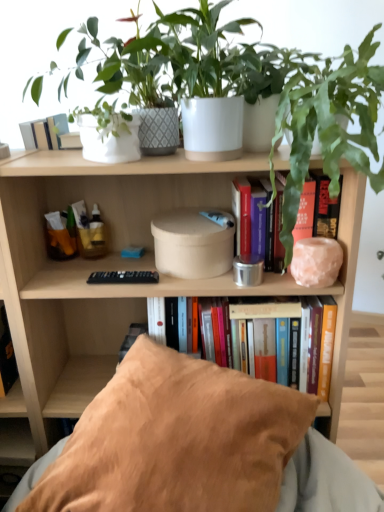
Question: Does beige fabric pillow at lower center have a smaller size compared to hardcover book at center, placed as the 2th book when sorted from bottom to top?

Choices:
 (A) no
 (B) yes

Answer: (A)

Question: Would you say beige fabric pillow at lower center is a long distance from hardcover book at center, placed as the 2th book when sorted from bottom to top?

Choices:
 (A) yes
 (B) no

Answer: (B)

Question: Is beige fabric pillow at lower center shorter than hardcover book at center, the 1th book viewed from the top?

Choices:
 (A) no
 (B) yes

Answer: (A)

Question: Is beige fabric pillow at lower center to the right of hardcover book at center, placed as the 2th book when sorted from bottom to top, from the viewer's perspective?

Choices:
 (A) yes
 (B) no

Answer: (B)

Question: Does beige fabric pillow at lower center have a greater width compared to hardcover book at center, placed as the 2th book when sorted from bottom to top?

Choices:
 (A) no
 (B) yes

Answer: (B)

Question: From a real-world perspective, is beige fabric pillow at lower center located higher than hardcover book at center, placed as the 2th book when sorted from bottom to top?

Choices:
 (A) yes
 (B) no

Answer: (B)

Question: Can you confirm if green leafy plant at upper right, the 1th houseplant when ordered from right to left, is taller than white ceramic pot at upper center, which appears as the 2th houseplant when viewed from the right?

Choices:
 (A) yes
 (B) no

Answer: (A)

Question: Is green leafy plant at upper right, which is counted as the second houseplant, starting from the left, at the left side of white ceramic pot at upper center, which appears as the 2th houseplant when viewed from the right?

Choices:
 (A) no
 (B) yes

Answer: (A)

Question: Does green leafy plant at upper right, the 1th houseplant when ordered from right to left, have a greater width compared to white ceramic pot at upper center, placed as the 1th houseplant when sorted from left to right?

Choices:
 (A) no
 (B) yes

Answer: (B)

Question: Is green leafy plant at upper right, which is counted as the second houseplant, starting from the left, not close to white ceramic pot at upper center, which appears as the 2th houseplant when viewed from the right?

Choices:
 (A) yes
 (B) no

Answer: (B)

Question: Is the surface of green leafy plant at upper right, the 1th houseplant when ordered from right to left, in direct contact with white ceramic pot at upper center, which appears as the 2th houseplant when viewed from the right?

Choices:
 (A) no
 (B) yes

Answer: (A)

Question: Can you confirm if green leafy plant at upper right, the 1th houseplant when ordered from right to left, is shorter than white ceramic pot at upper center, which appears as the 2th houseplant when viewed from the right?

Choices:
 (A) yes
 (B) no

Answer: (B)

Question: Is beige fabric pillow at lower center oriented away from white ceramic pot at upper center, which appears as the 2th houseplant when viewed from the right?

Choices:
 (A) yes
 (B) no

Answer: (B)